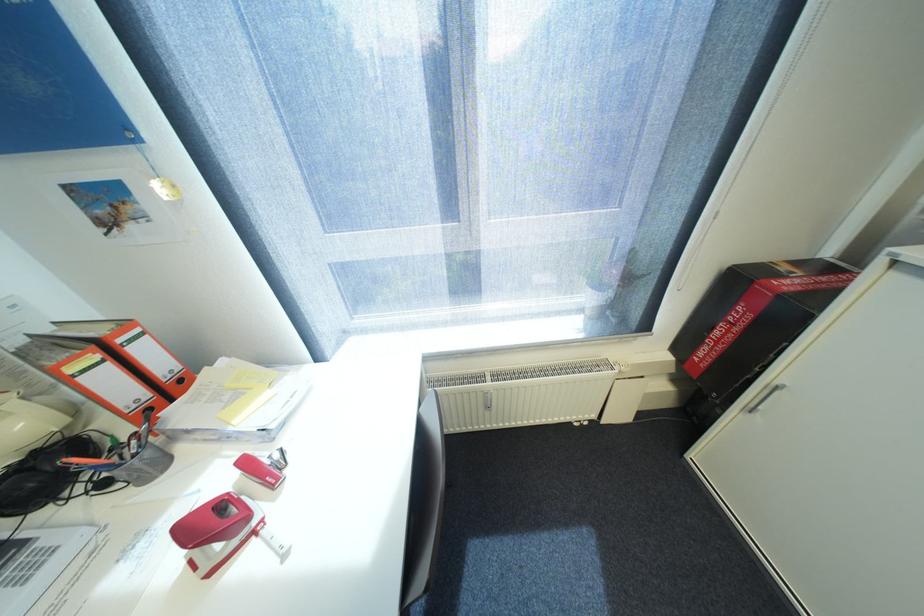
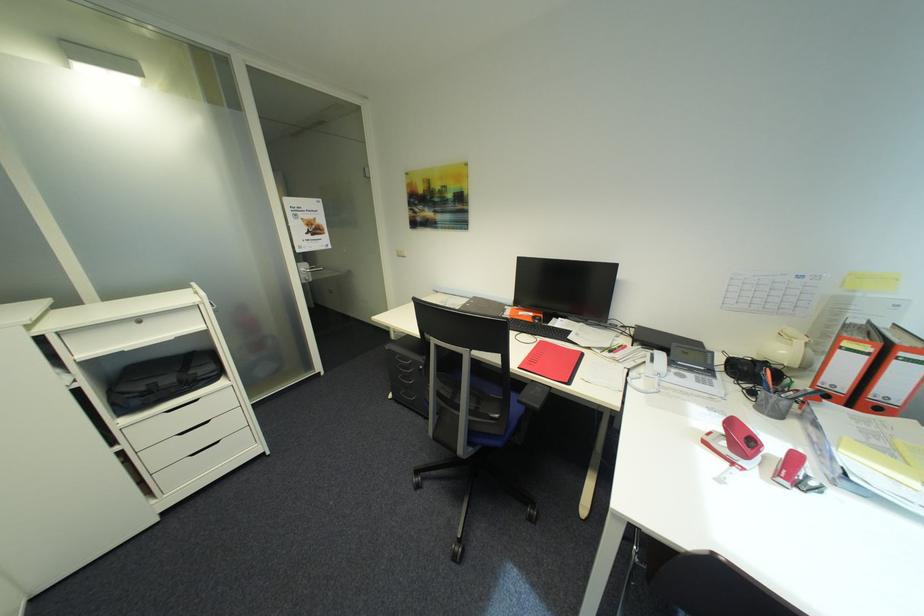
Where in the second image is the point corresponding to (x=233, y=548) from the first image?

(730, 447)